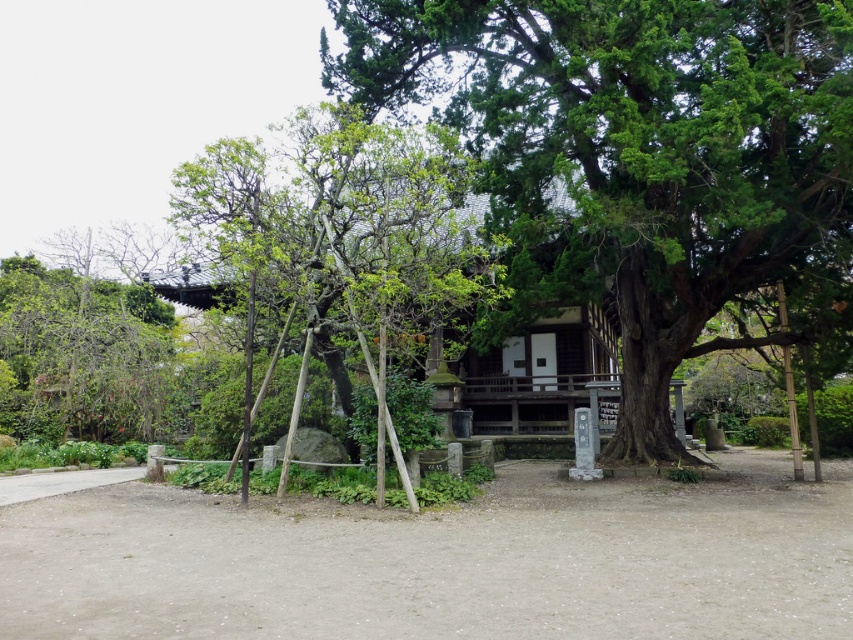
You are planning to plant a new tree in your garden. You have two options from the image shown, the green textured tree at center and the green leafy tree at center. Which tree takes up more space when fully grown?

The green leafy tree at center takes up more space than the green textured tree at center because it occupies more space according to the description.

You are standing in a traditional Japanese garden and want to take a photo of both the green leafy tree at center and the green leafy tree at left. Which tree should you move towards to get both in the frame without moving your camera position?

You should move towards the green leafy tree at left because the green leafy tree at center is closer to the viewer, so moving towards the farther tree would help balance their positions in the frame.